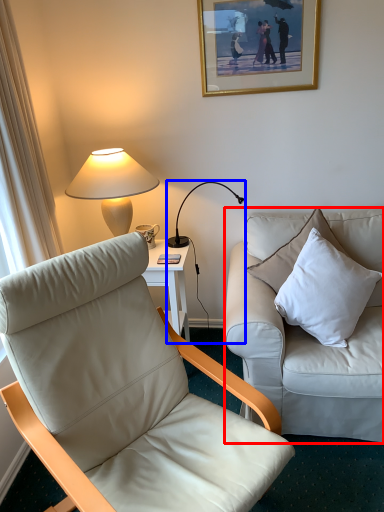
Question: Among these objects, which one is farthest to the camera, studio couch (highlighted by a red box) or lamp (highlighted by a blue box)?

Choices:
 (A) studio couch
 (B) lamp

Answer: (B)